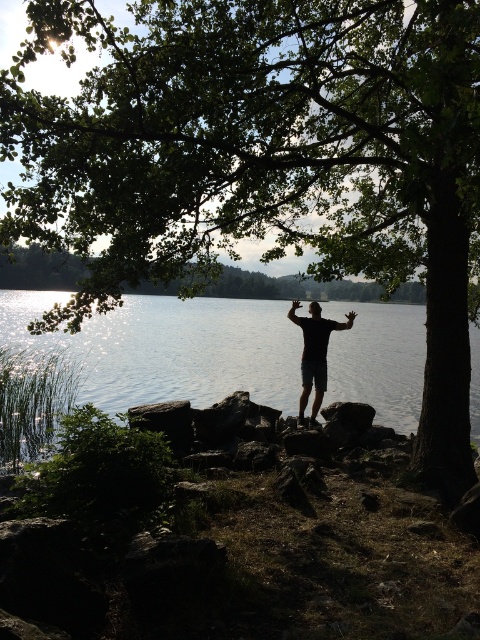
You are a photographer trying to capture the scene of the person at the lakeside. You notice the black matte shorts at center and the black matte arm at center. Which object should you focus on first to ensure both are in sharp focus, considering their positions?

The black matte shorts at center is in front of the black matte arm at center. To ensure both are in sharp focus, you should focus on the black matte arm at center first since it is farther away, allowing the shorts in front to also be in focus with proper depth of field.